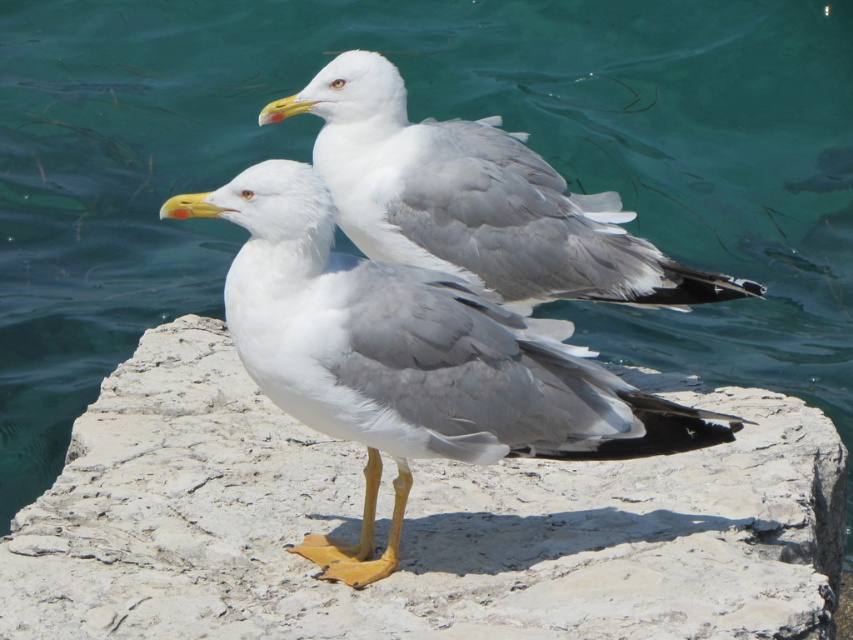
You are standing in front of the image and want to place a small flag exactly at the position of the white stone at center. According to the coordinates provided, where should you place the flag?

The white stone at center is located at point (415, 524), so you should place the flag at those coordinates.

You are a birdwatcher observing the scene. You notice the white feathered seagull at center and the white stone at center. Which object is closer to you?

The white feathered seagull at center is closer to you because it is positioned above the white stone at center.